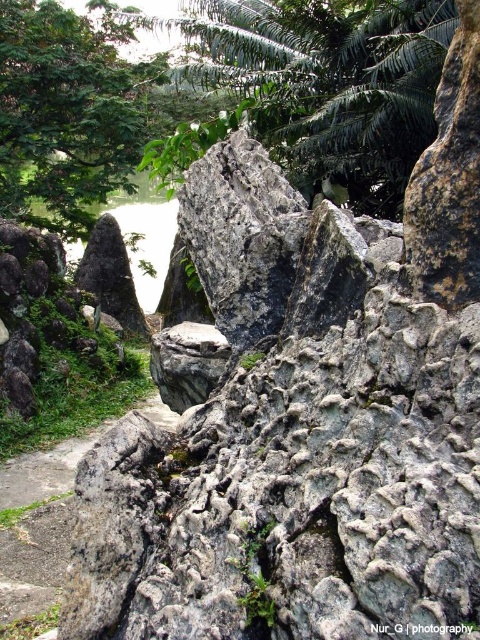
Question: Considering the relative positions of green leafy tree at upper center and green leafy tree at upper left in the image provided, where is green leafy tree at upper center located with respect to green leafy tree at upper left?

Choices:
 (A) right
 (B) left

Answer: (A)

Question: Is green leafy tree at upper center above green leafy tree at upper left?

Choices:
 (A) yes
 (B) no

Answer: (B)

Question: Among these objects, which one is farthest from the camera?

Choices:
 (A) green leafy tree at upper left
 (B) green leafy tree at upper center

Answer: (A)

Question: Which point is closer to the camera?

Choices:
 (A) (355, 60)
 (B) (6, 202)

Answer: (A)

Question: Is green leafy tree at upper center bigger than green leafy tree at upper left?

Choices:
 (A) yes
 (B) no

Answer: (B)